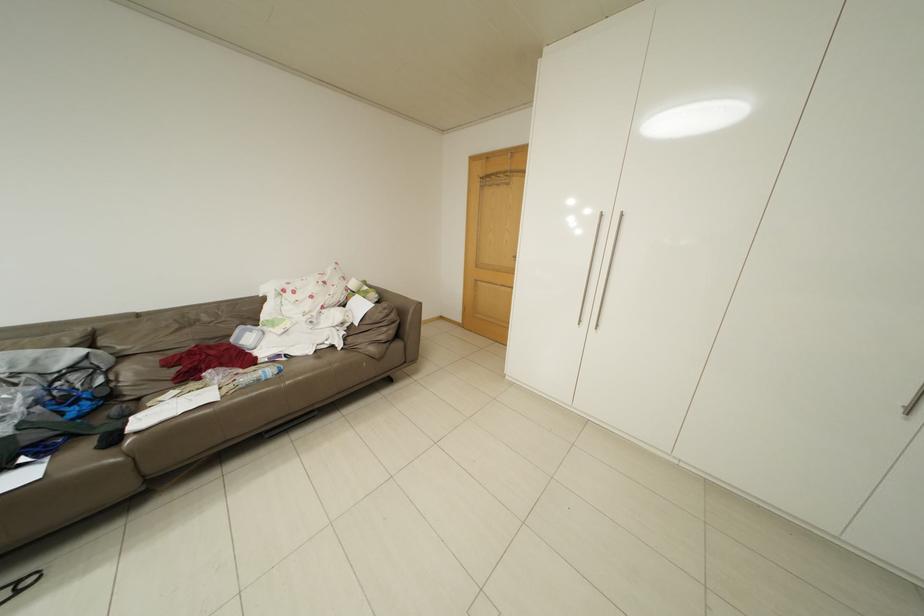
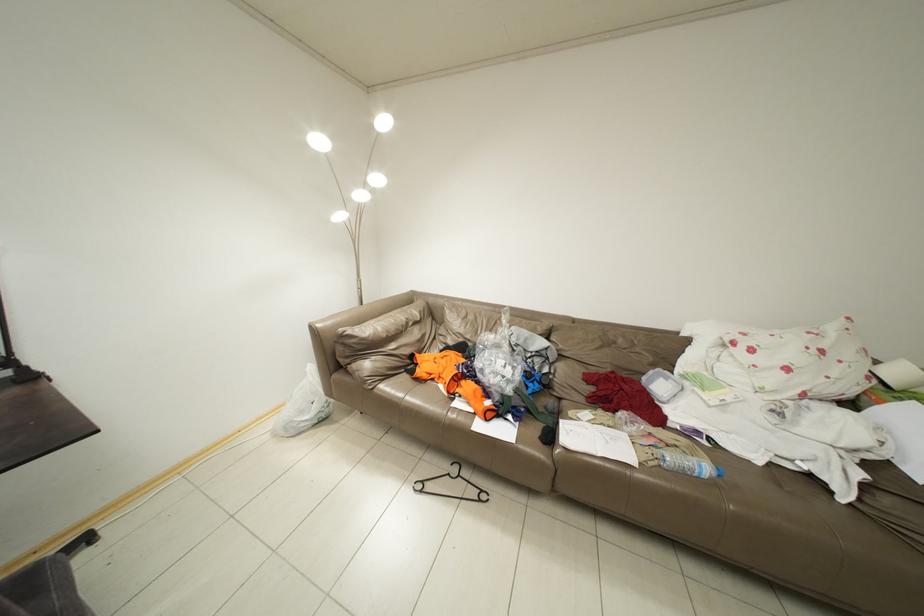
Question: The first image is from the beginning of the video and the second image is from the end. How did the camera likely rotate when shooting the video?

Choices:
 (A) Left
 (B) Right
 (C) Up
 (D) Down

Answer: (A)